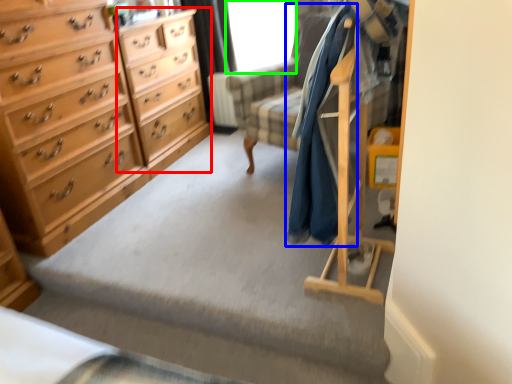
Question: Which object is the closest to the file cabinet (highlighted by a red box)? Choose among these: clothing (highlighted by a blue box) or window screen (highlighted by a green box).

Choices:
 (A) clothing
 (B) window screen

Answer: (B)